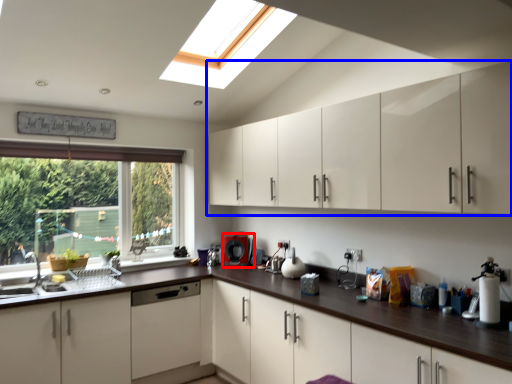
Question: Which of the following is the closest to the observer, coffee machine (highlighted by a red box) or cabinetry (highlighted by a blue box)?

Choices:
 (A) coffee machine
 (B) cabinetry

Answer: (B)